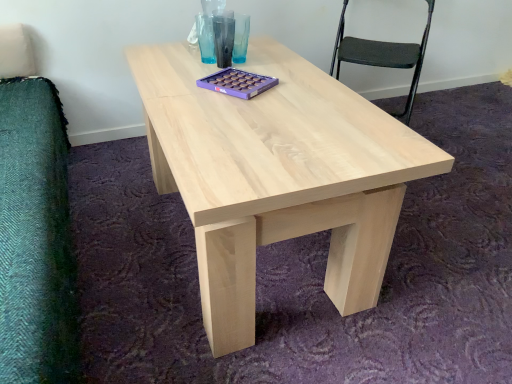
Question: In terms of width, does natural wood coffee table at center look wider or thinner when compared to black fabric chair at upper right?

Choices:
 (A) wide
 (B) thin

Answer: (A)

Question: Is natural wood coffee table at center inside or outside of black fabric chair at upper right?

Choices:
 (A) outside
 (B) inside

Answer: (A)

Question: Is point (251, 314) closer or farther from the camera than point (424, 39)?

Choices:
 (A) closer
 (B) farther

Answer: (A)

Question: Considering the positions of point (378, 64) and point (166, 46), is point (378, 64) closer or farther from the camera than point (166, 46)?

Choices:
 (A) farther
 (B) closer

Answer: (A)

Question: In the image, is black fabric chair at upper right positioned in front of or behind natural wood coffee table at center?

Choices:
 (A) behind
 (B) front

Answer: (A)

Question: Considering the positions of black fabric chair at upper right and natural wood coffee table at center in the image, is black fabric chair at upper right taller or shorter than natural wood coffee table at center?

Choices:
 (A) tall
 (B) short

Answer: (A)

Question: Considering the relative positions of black fabric chair at upper right and natural wood coffee table at center in the image provided, is black fabric chair at upper right to the left or to the right of natural wood coffee table at center?

Choices:
 (A) right
 (B) left

Answer: (B)